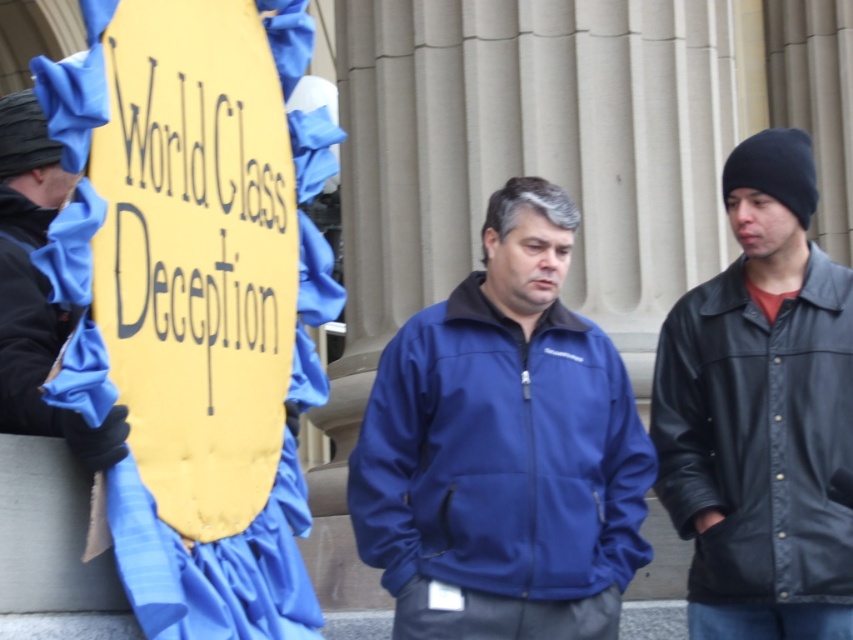
You are standing in front of the building and want to hand a document to the person in the black leather jacket at left. However, you notice another person wearing a black leather jacket at right. Which direction should you walk to ensure you approach the correct individual?

You should walk to the left because the black leather jacket at left is on the left side of the frame, while the black leather jacket at right is positioned further to the right. Since you want to reach the one on the left, moving in that direction will lead you towards them.

You are standing at the origin point of the coordinate system. The building with classical columns is directly in front of you. Where is the matte blue jacket at center located in terms of coordinates?

The matte blue jacket at center is located at coordinates point (500, 456).

You are standing at the point with coordinates point [42,416] and want to walk to the point with coordinates point [460,392]. Is there a clear path between these two points?

The point [460,392] is behind point [42,416], so there is an obstruction between them. Therefore, there is no clear path between these two points.